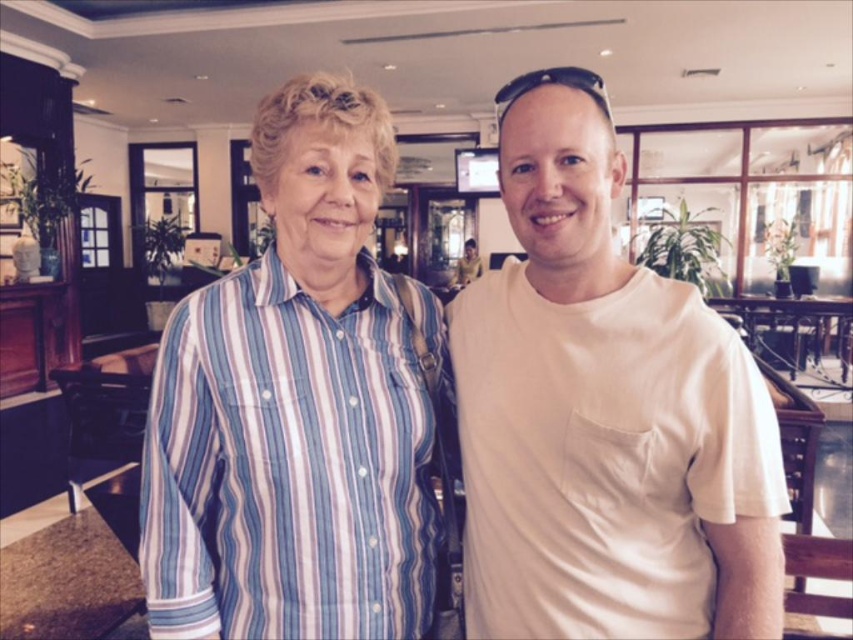
Which is above, white matte t-shirt at center or blue striped shirt at center?

blue striped shirt at center is above.

Is white matte t-shirt at center bigger than blue striped shirt at center?

Correct, white matte t-shirt at center is larger in size than blue striped shirt at center.

Does point (590, 275) come farther from viewer compared to point (279, 376)?

Yes, point (590, 275) is farther from viewer.

You are a GUI agent. You are given a task and a screenshot of the screen. Output one action in this format:
    pyautogui.click(x=<x>, y=<y>)
    Task: Click on the white matte t-shirt at center
    The width and height of the screenshot is (853, 640).
    Given the screenshot: What is the action you would take?
    pyautogui.click(x=604, y=413)